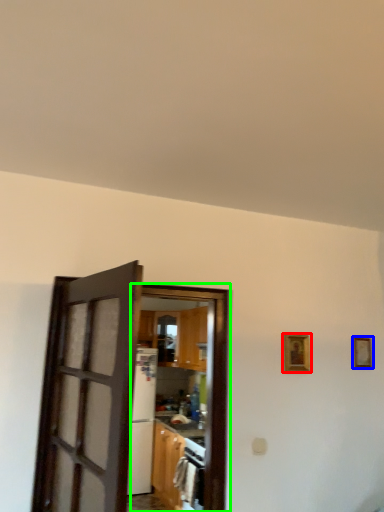
Question: Which is farther away from picture frame (highlighted by a red box)? picture frame (highlighted by a blue box) or door (highlighted by a green box)?

Choices:
 (A) picture frame
 (B) door

Answer: (B)